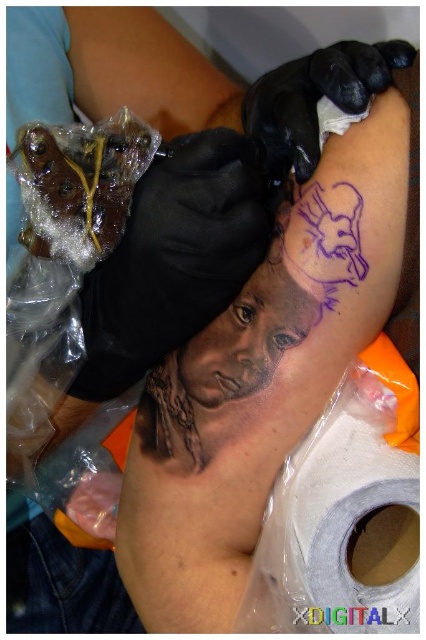
This screenshot has height=640, width=426. Describe the element at coordinates (314, 99) in the screenshot. I see `black rubber glove at upper center` at that location.

Can you confirm if black rubber glove at upper center is thinner than translucent plastic at lower left?

Incorrect, black rubber glove at upper center's width is not less than translucent plastic at lower left's.

Image resolution: width=426 pixels, height=640 pixels. I want to click on black rubber glove at upper center, so click(314, 99).

Is purple ink tattoo at upper center smaller than purple ink tattoo at upper right?

Incorrect, purple ink tattoo at upper center is not smaller in size than purple ink tattoo at upper right.

Can you confirm if purple ink tattoo at upper center is taller than purple ink tattoo at upper right?

Indeed, purple ink tattoo at upper center has a greater height compared to purple ink tattoo at upper right.

Is point (146, 58) farther from camera compared to point (307, 275)?

Yes, point (146, 58) is farther from viewer.

Where is `purple ink tattoo at upper center`? The width and height of the screenshot is (426, 640). purple ink tattoo at upper center is located at coordinates (143, 68).

Is point (313, 280) positioned before point (100, 480)?

Yes, point (313, 280) is in front of point (100, 480).

Is purple ink tattoo at upper right positioned before translucent plastic at lower left?

Yes, it is.

Is point (319, 298) less distant than point (97, 531)?

Yes.

This screenshot has height=640, width=426. Find the location of `purple ink tattoo at upper right`. purple ink tattoo at upper right is located at coordinates (324, 241).